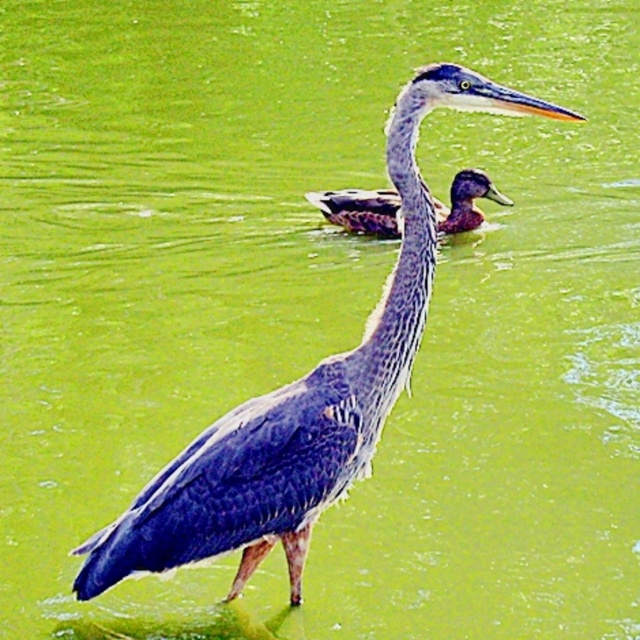
Is blue feathered heron at center shorter than greenish-brown feathers duck at center?

Incorrect, blue feathered heron at center's height does not fall short of greenish-brown feathers duck at center's.

What do you see at coordinates (301, 400) in the screenshot?
I see `blue feathered heron at center` at bounding box center [301, 400].

Identify the location of blue feathered heron at center. The image size is (640, 640). (301, 400).